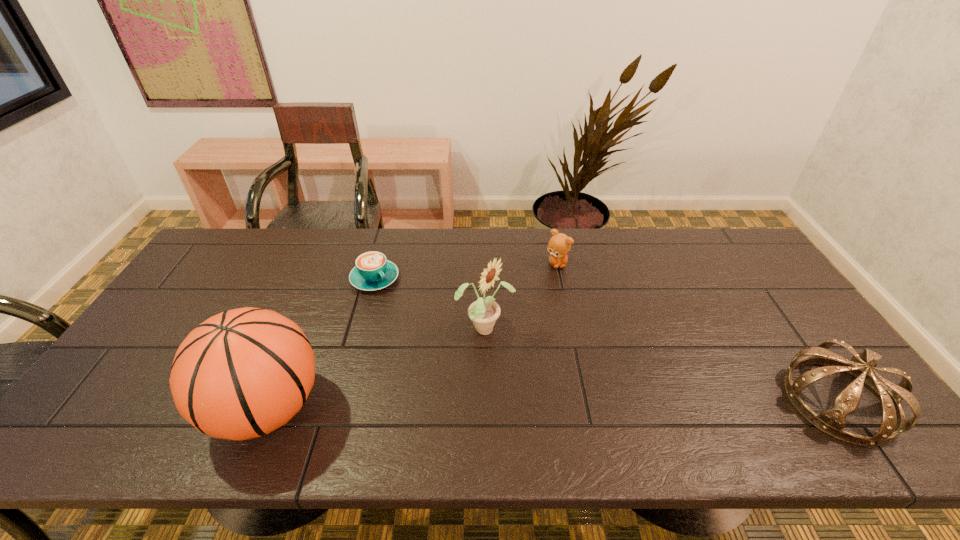
The width and height of the screenshot is (960, 540). In order to click on free spot on the desktop that is between the basketball and the rightmost object and is positioned on the face of the second object from right to left in this screenshot , I will do `click(612, 404)`.

Locate an element on the screen. This screenshot has height=540, width=960. free space on the desktop that is between the basketball and the rightmost object and is positioned with the handle on the right side of the cappuccino is located at coordinates (495, 406).

Find the location of a particular element. free spot on the desktop that is between the basketball and the tiara and is positioned on the front-facing side of the third object from left to right is located at coordinates (612, 404).